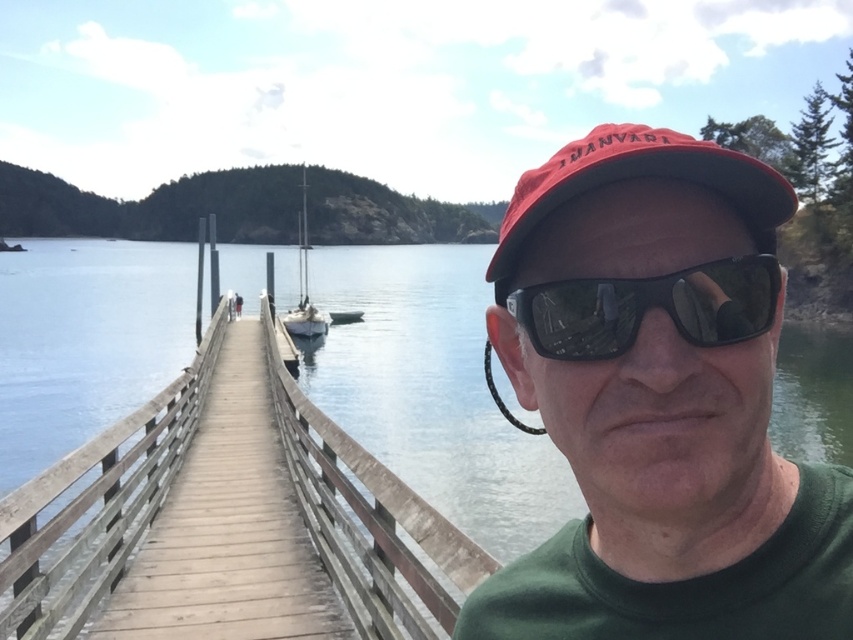
Can you confirm if matte red cap at center is wider than red matte baseball cap at upper center?

No.

Who is positioned more to the left, matte red cap at center or red matte baseball cap at upper center?

matte red cap at center

Which is in front, point (693, 374) or point (569, 163)?

Point (693, 374)

The height and width of the screenshot is (640, 853). I want to click on matte red cap at center, so click(x=659, y=403).

Is point (96, 490) in front of point (283, 323)?

Yes.

You are a GUI agent. You are given a task and a screenshot of the screen. Output one action in this format:
    pyautogui.click(x=<x>, y=<y>)
    Task: Click on the brown wooden rail at center
    The height and width of the screenshot is (640, 853).
    Given the screenshot: What is the action you would take?
    pyautogui.click(x=97, y=509)

You are a GUI agent. You are given a task and a screenshot of the screen. Output one action in this format:
    pyautogui.click(x=<x>, y=<y>)
    Task: Click on the brown wooden rail at center
    
    Given the screenshot: What is the action you would take?
    pyautogui.click(x=97, y=509)

In the scene shown: Between brown wooden rail at center and black reflective sunglasses at center, which one is positioned higher?

Positioned higher is black reflective sunglasses at center.

Which of these two, brown wooden rail at center or black reflective sunglasses at center, stands taller?

Standing taller between the two is brown wooden rail at center.

You are a GUI agent. You are given a task and a screenshot of the screen. Output one action in this format:
    pyautogui.click(x=<x>, y=<y>)
    Task: Click on the brown wooden rail at center
    This screenshot has height=640, width=853.
    Given the screenshot: What is the action you would take?
    pyautogui.click(x=97, y=509)